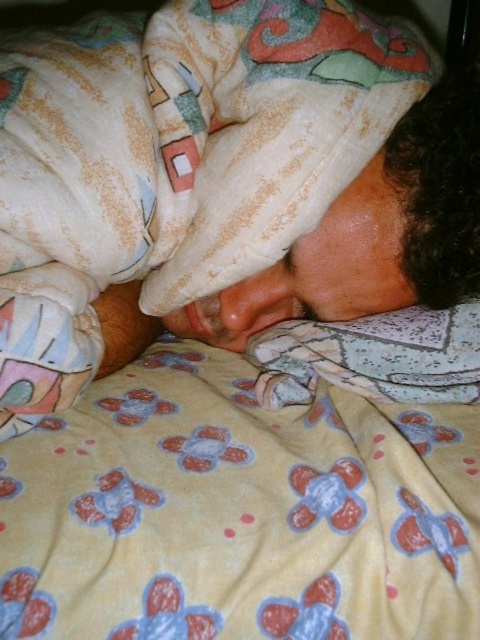
Who is positioned more to the left, yellow fleece blanket at lower center or fluffy white pillow at lower center?

Positioned to the left is yellow fleece blanket at lower center.

Does yellow fleece blanket at lower center appear under fluffy white pillow at lower center?

Indeed, yellow fleece blanket at lower center is positioned under fluffy white pillow at lower center.

Between point (84, 472) and point (387, 342), which one is positioned in front?

Point (84, 472) is in front.

I want to click on yellow fleece blanket at lower center, so click(256, 492).